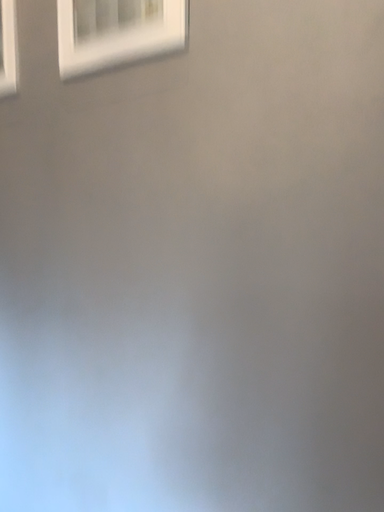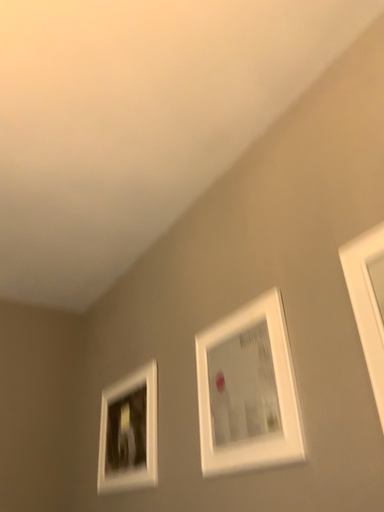
Question: Which way did the camera rotate in the video?

Choices:
 (A) rotated downward
 (B) rotated upward

Answer: (B)